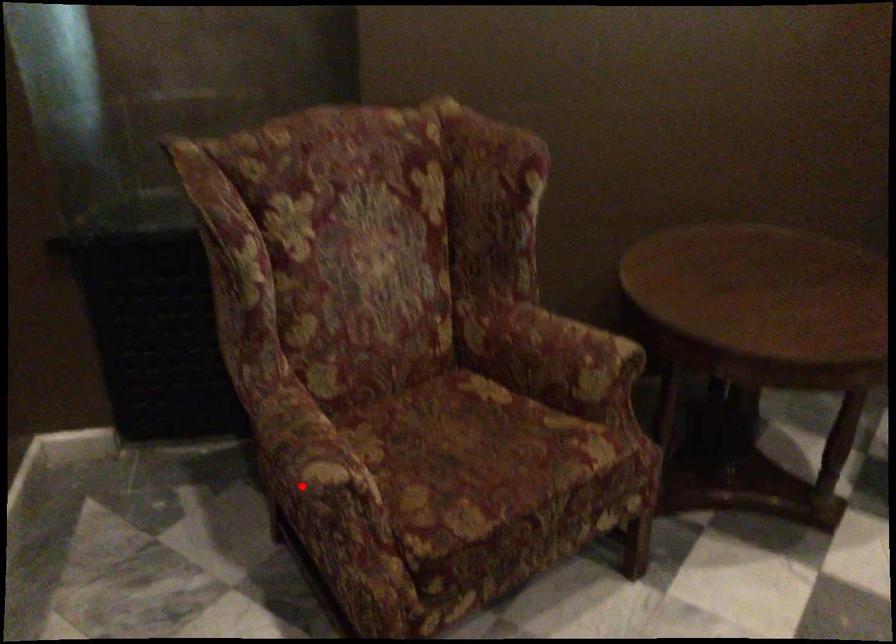
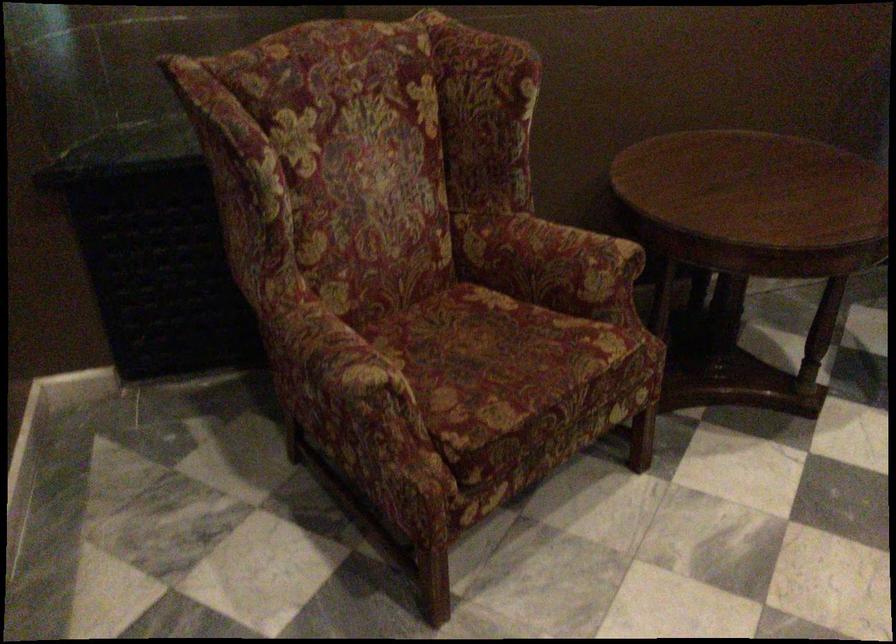
The point at the highlighted location is marked in the first image. Where is the corresponding point in the second image?

(343, 389)